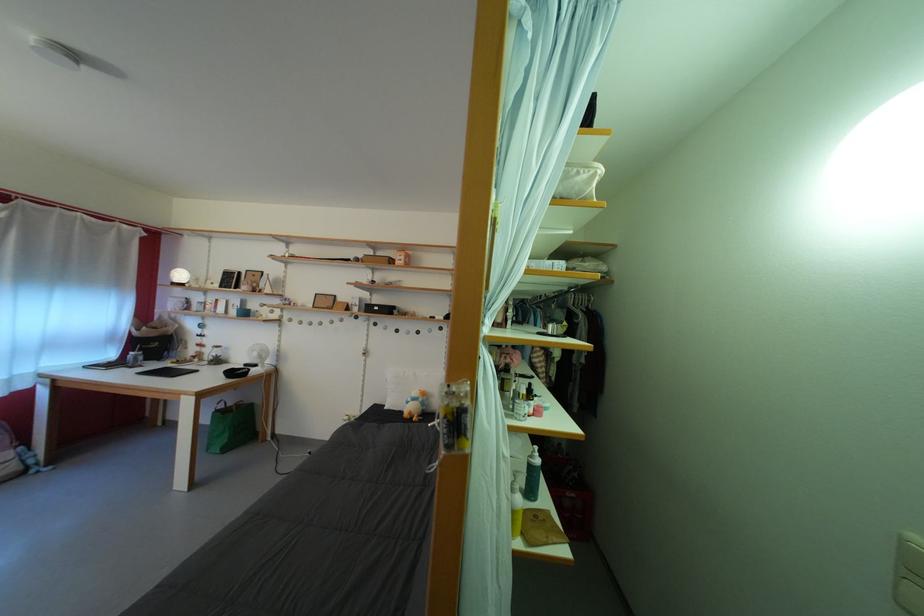
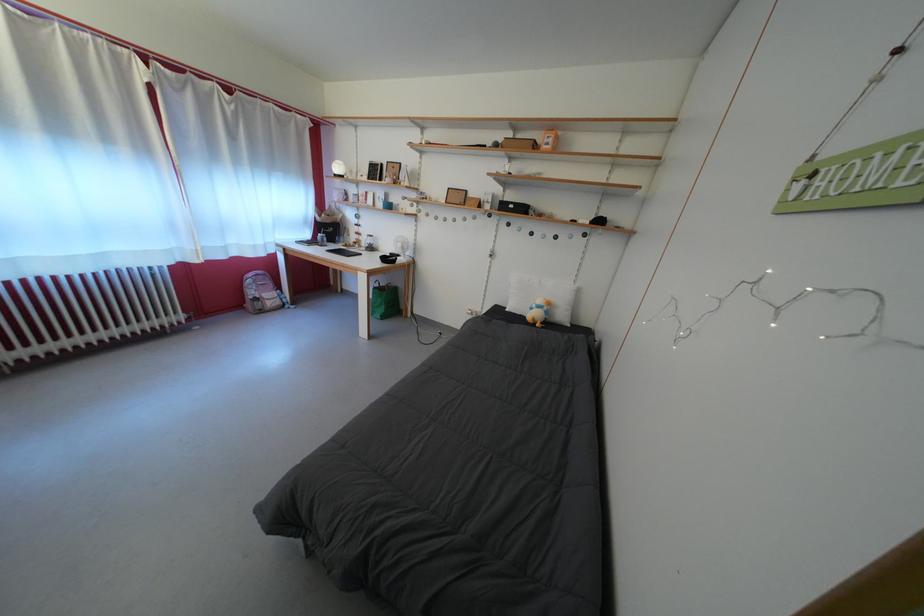
Locate, in the second image, the point that corresponds to point (207, 355) in the first image.

(365, 243)